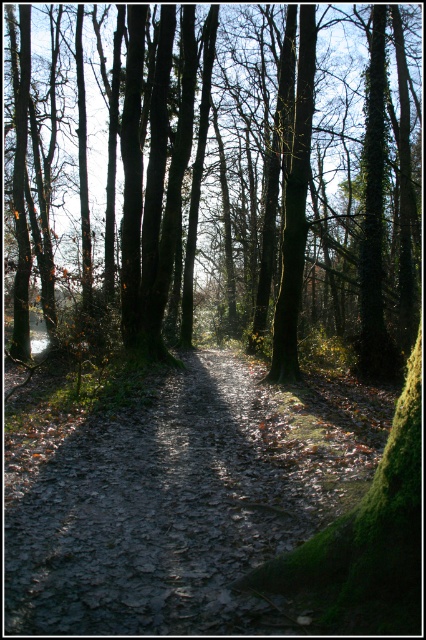
Is green mossy tree at center to the left of muddy dirt path at center from the viewer's perspective?

No, green mossy tree at center is not to the left of muddy dirt path at center.

Is green mossy tree at center further to the viewer compared to muddy dirt path at center?

Yes, green mossy tree at center is further from the viewer.

Is point (281, 115) positioned in front of point (140, 536)?

No, it is not.

Find the location of `green mossy tree at center`. green mossy tree at center is located at coordinates point(219,176).